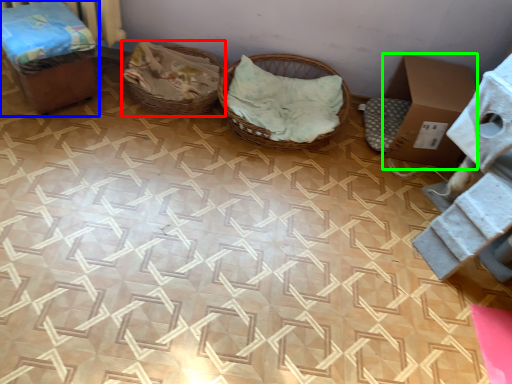
Question: Which object is positioned closest to basket (highlighted by a red box)? Select from furniture (highlighted by a blue box) and cardboard box (highlighted by a green box).

Choices:
 (A) furniture
 (B) cardboard box

Answer: (A)